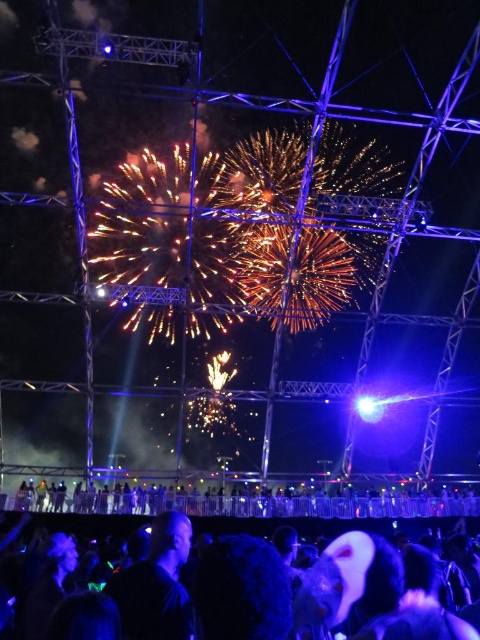
In the scene shown: Can you confirm if black matte crowd at lower center is thinner than bright white spotlight at upper center?

No, black matte crowd at lower center is not thinner than bright white spotlight at upper center.

Is point (386, 516) more distant than point (368, 403)?

No, (386, 516) is in front of (368, 403).

Which is in front, point (277, 500) or point (377, 400)?

Point (277, 500) is in front.

Identify the location of black matte crowd at lower center. The width and height of the screenshot is (480, 640). (243, 502).

Does black matte crowd at lower center have a greater width compared to black fabric crowd at lower center?

Indeed, black matte crowd at lower center has a greater width compared to black fabric crowd at lower center.

Locate an element on the screen. The width and height of the screenshot is (480, 640). black matte crowd at lower center is located at coordinates (243, 502).

Is point (325, 502) behind point (112, 534)?

Yes, it is.

At what (x,y) coordinates should I click in order to perform the action: click on black matte crowd at lower center. Please return your answer as a coordinate pair (x, y). The width and height of the screenshot is (480, 640). Looking at the image, I should click on (243, 502).

Does black fabric crowd at lower center have a lesser width compared to bright white spotlight at upper center?

Incorrect, black fabric crowd at lower center's width is not less than bright white spotlight at upper center's.

Between point (250, 529) and point (379, 397), which one is positioned behind?

Positioned behind is point (379, 397).

Who is more distant from viewer, (113,525) or (383,406)?

The point (383,406) is behind.

Locate an element on the screen. The image size is (480, 640). black fabric crowd at lower center is located at coordinates (324, 525).